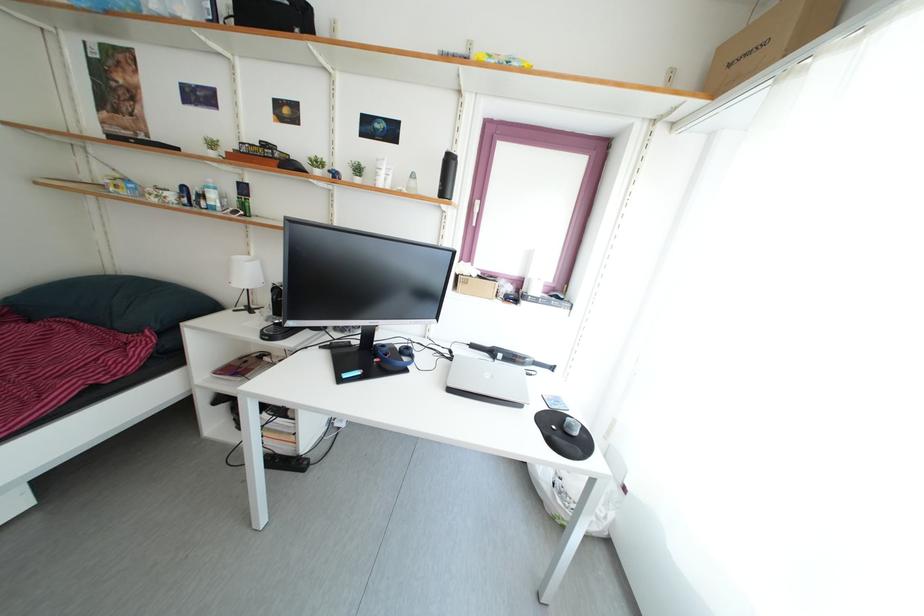
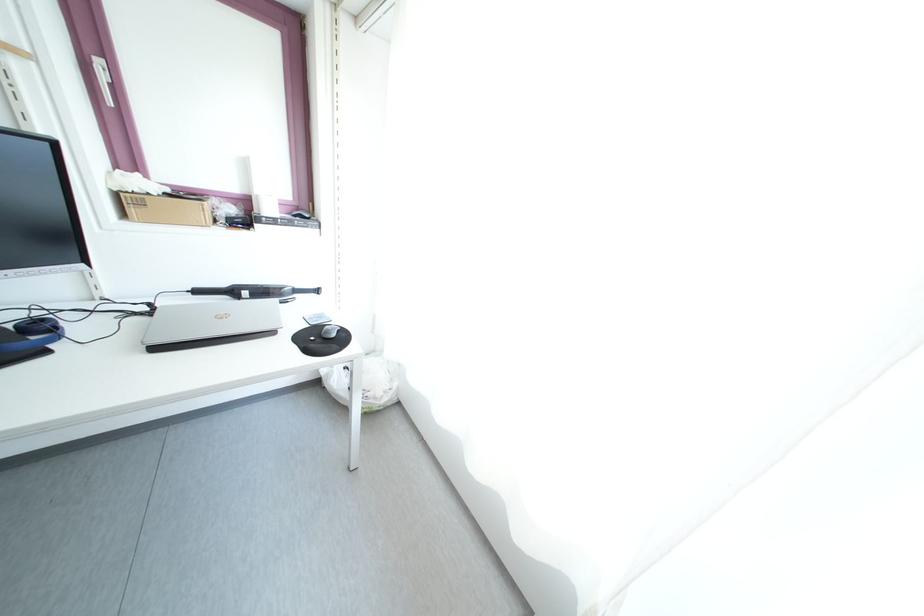
The point at (485,285) is marked in the first image. Where is the corresponding point in the second image?

(174, 203)